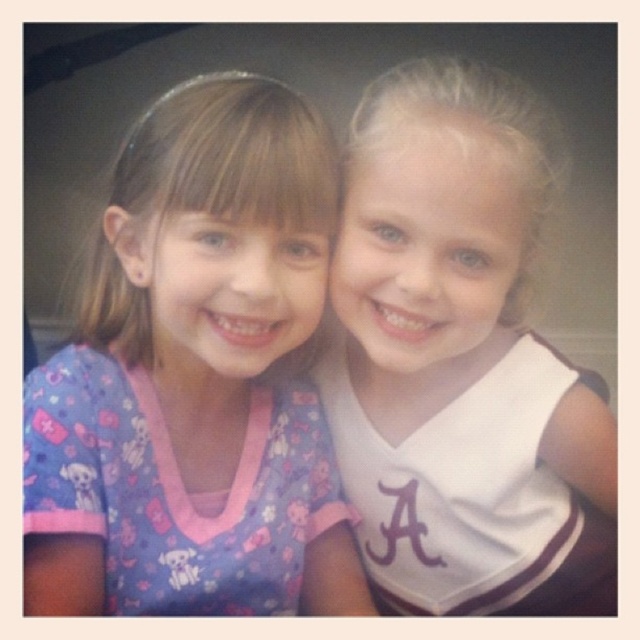
Question: Does purple fabric shirt at center have a lesser width compared to white jersey at center?

Choices:
 (A) yes
 (B) no

Answer: (A)

Question: Does purple fabric shirt at center come in front of white jersey at center?

Choices:
 (A) no
 (B) yes

Answer: (B)

Question: Which of the following is the farthest from the observer?

Choices:
 (A) (381, 422)
 (B) (84, 305)

Answer: (A)

Question: Observing the image, what is the correct spatial positioning of purple fabric shirt at center in reference to white jersey at center?

Choices:
 (A) left
 (B) right

Answer: (A)